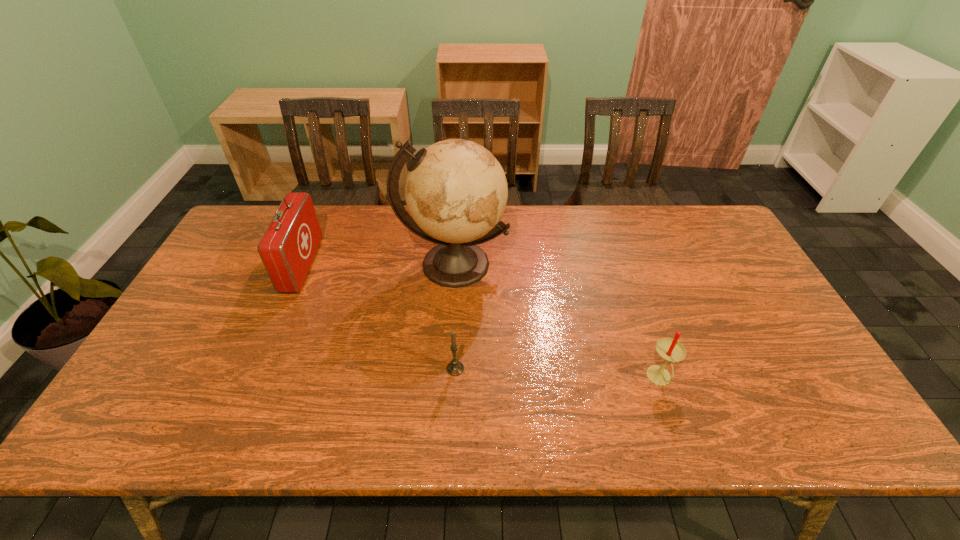
The image size is (960, 540). I want to click on vacant area that lies between the tallest object and the shorter candle, so click(x=454, y=316).

The height and width of the screenshot is (540, 960). In order to click on free spot between the rightmost object and the leftmost object in this screenshot , I will do `click(481, 322)`.

Identify the location of empty space between the tallest object and the right candle. (557, 321).

The image size is (960, 540). In order to click on free space between the shorter candle and the leftmost object in this screenshot , I will do `click(379, 317)`.

This screenshot has height=540, width=960. Find the location of `free spot between the shorter candle and the second tallest object`. free spot between the shorter candle and the second tallest object is located at coordinates (379, 317).

What are the coordinates of `empty space that is in between the left candle and the taller candle` in the screenshot? It's located at (558, 374).

The height and width of the screenshot is (540, 960). I want to click on object that stands as the second closest to the tallest object, so click(x=287, y=249).

Identify the location of the second closest object to the globe. (287, 249).

Locate an element on the screen. The width and height of the screenshot is (960, 540). free location that satisfies the following two spatial constraints: 1. on the side of the third shortest object with the first aid cross symbol; 2. on the right side of the left candle is located at coordinates (258, 369).

Image resolution: width=960 pixels, height=540 pixels. I want to click on blank area in the image that satisfies the following two spatial constraints: 1. on the front-facing side of the globe; 2. on the side of the third shortest object with the first aid cross symbol, so click(454, 266).